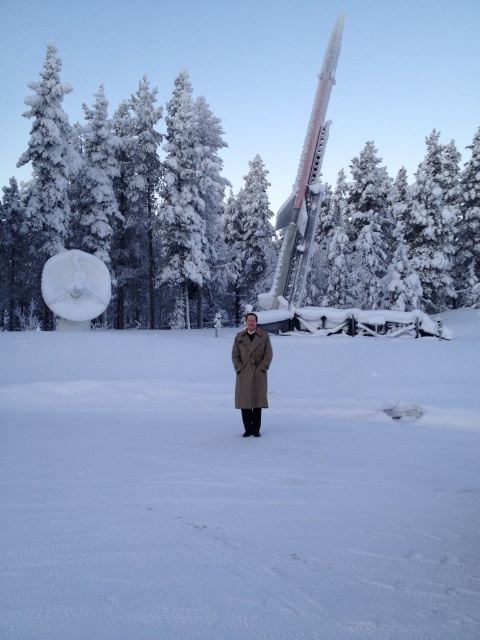
Which is more to the left, white powdery snow at center or brown matte trench coat at center?

brown matte trench coat at center

Is point (37, 336) behind point (244, 355)?

Yes, it is behind point (244, 355).

At what (x,y) coordinates should I click in order to perform the action: click on white powdery snow at center. Please return your answer as a coordinate pair (x, y). Looking at the image, I should click on (239, 488).

Is point (122, 285) positioned in front of point (264, 292)?

No.

This screenshot has height=640, width=480. Describe the element at coordinates (230, 211) in the screenshot. I see `white snow-covered tree at upper center` at that location.

Where is `white snow-covered tree at upper center`? The width and height of the screenshot is (480, 640). white snow-covered tree at upper center is located at coordinates (230, 211).

Is point (343, 564) closer to camera compared to point (283, 250)?

Yes, it is in front of point (283, 250).

Is white powdery snow at center taller than shiny metallic rocket at center?

Incorrect, white powdery snow at center's height is not larger of shiny metallic rocket at center's.

Who is more distant from viewer, (80, 529) or (300, 204)?

The point (300, 204) is more distant.

Locate an element on the screen. white powdery snow at center is located at coordinates (239, 488).